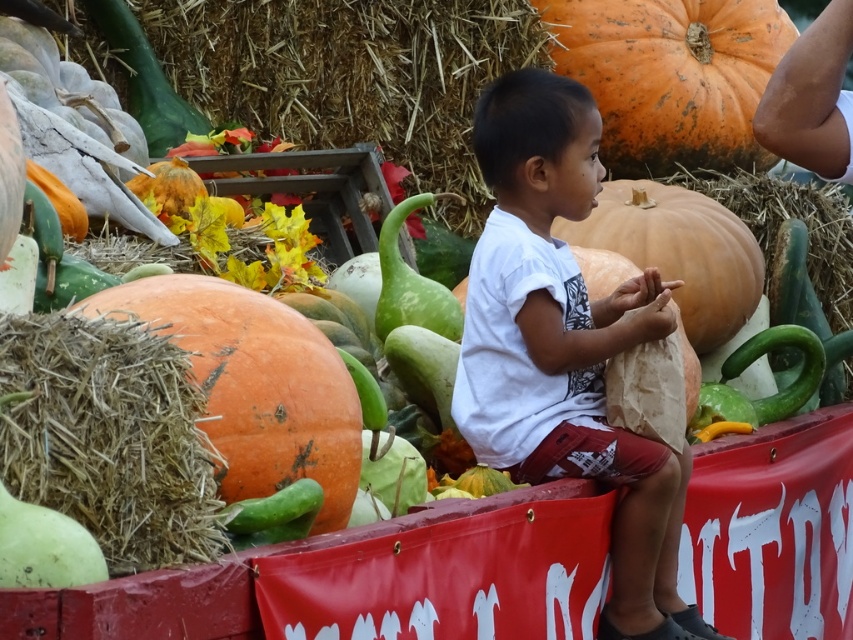
Between brown straw at lower left and orange matte pumpkin at upper right, which one is positioned higher?

orange matte pumpkin at upper right is above.

Can you confirm if brown straw at lower left is thinner than orange matte pumpkin at upper right?

Correct, brown straw at lower left's width is less than orange matte pumpkin at upper right's.

Is point (49, 376) positioned behind point (704, 3)?

No, (49, 376) is closer to viewer.

At what (x,y) coordinates should I click in order to perform the action: click on brown straw at lower left. Please return your answer as a coordinate pair (x, y). Image resolution: width=853 pixels, height=640 pixels. Looking at the image, I should click on (109, 436).

Find the location of a particular element. This screenshot has width=853, height=640. orange matte pumpkin at left is located at coordinates (256, 385).

Identify the location of orange matte pumpkin at left. [x=256, y=385].

Can you confirm if white cotton shirt at center is positioned above orange matte pumpkin at left?

Incorrect, white cotton shirt at center is not positioned above orange matte pumpkin at left.

Can you confirm if white cotton shirt at center is positioned below orange matte pumpkin at left?

Yes.

Does point (635, 529) come in front of point (341, 515)?

That is False.

You are a GUI agent. You are given a task and a screenshot of the screen. Output one action in this format:
    pyautogui.click(x=<x>, y=<y>)
    Task: Click on the white cotton shirt at center
    The height and width of the screenshot is (640, 853).
    Given the screenshot: What is the action you would take?
    pyautogui.click(x=566, y=346)